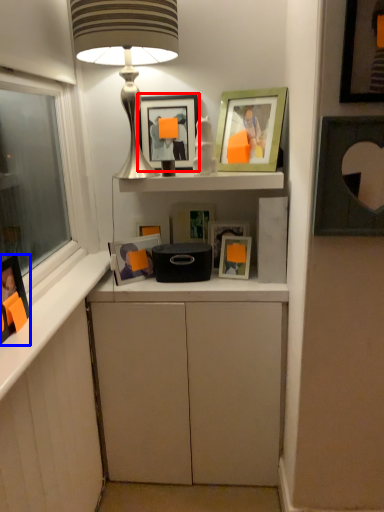
Question: Among these objects, which one is nearest to the camera, picture frame (highlighted by a red box) or picture frame (highlighted by a blue box)?

Choices:
 (A) picture frame
 (B) picture frame

Answer: (B)